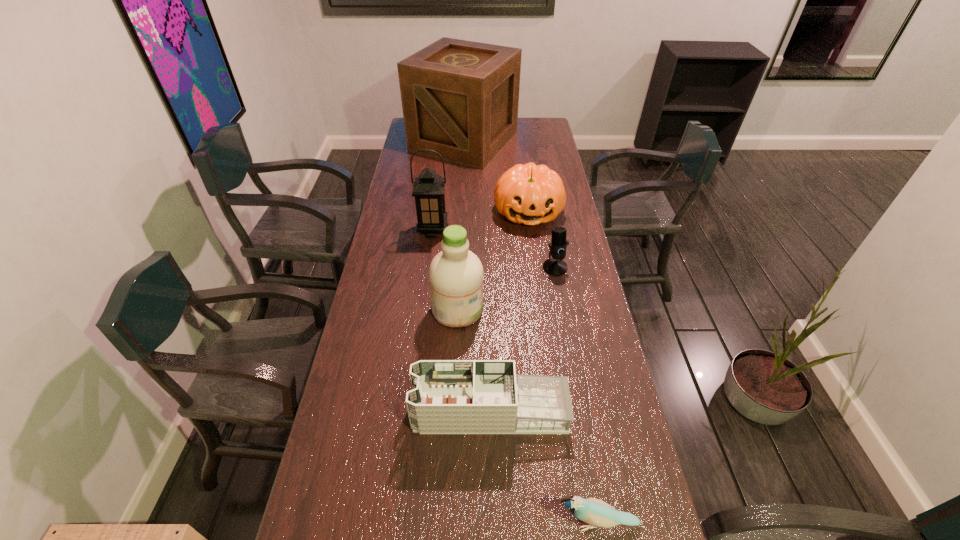
You are a GUI agent. You are given a task and a screenshot of the screen. Output one action in this format:
    pyautogui.click(x=<x>, y=<y>)
    Task: Click on the box positioned at the left edge
    
    Given the screenshot: What is the action you would take?
    pyautogui.click(x=460, y=98)

At what (x,y) coordinates should I click in order to perform the action: click on lantern present at the left edge. Please return your answer as a coordinate pair (x, y). The height and width of the screenshot is (540, 960). Looking at the image, I should click on (428, 190).

At what (x,y) coordinates should I click in order to perform the action: click on pumpkin that is at the right edge. Please return your answer as a coordinate pair (x, y). Image resolution: width=960 pixels, height=540 pixels. Looking at the image, I should click on (529, 194).

Locate an element on the screen. microphone located at the right edge is located at coordinates (555, 266).

This screenshot has width=960, height=540. I want to click on dollhouse at the right edge, so click(x=448, y=396).

Identify the location of bird located at the right edge. The image size is (960, 540). (595, 512).

At what (x,y) coordinates should I click in order to perform the action: click on object that is at the far left corner. Please return your answer as a coordinate pair (x, y). The image size is (960, 540). Looking at the image, I should click on (460, 98).

Identify the location of vacant space at the left edge of the desktop. Image resolution: width=960 pixels, height=540 pixels. (415, 283).

In the image, there is a desktop. Where is `blank space at the right edge`? The image size is (960, 540). blank space at the right edge is located at coordinates (531, 142).

Identify the location of empty space between the pumpkin and the second nearest object. (510, 312).